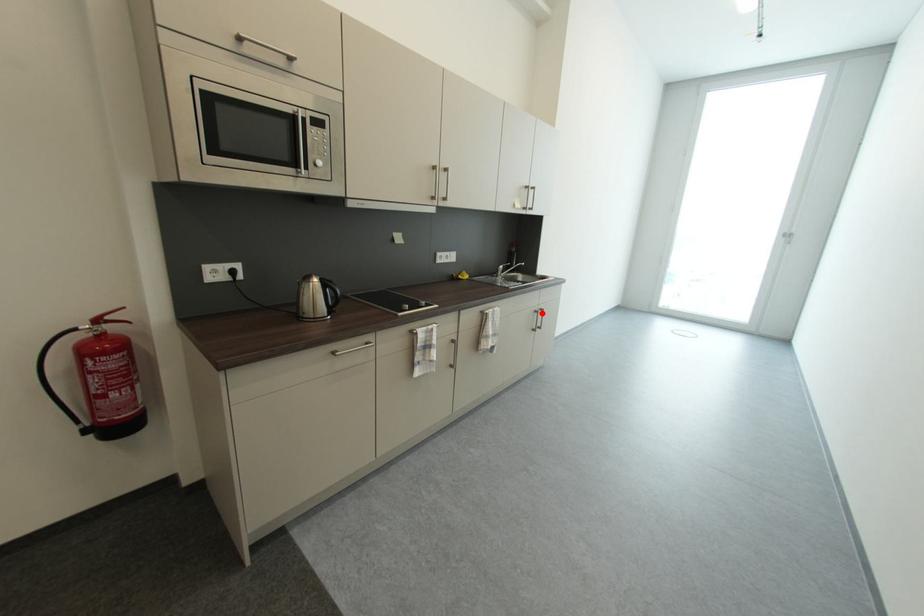
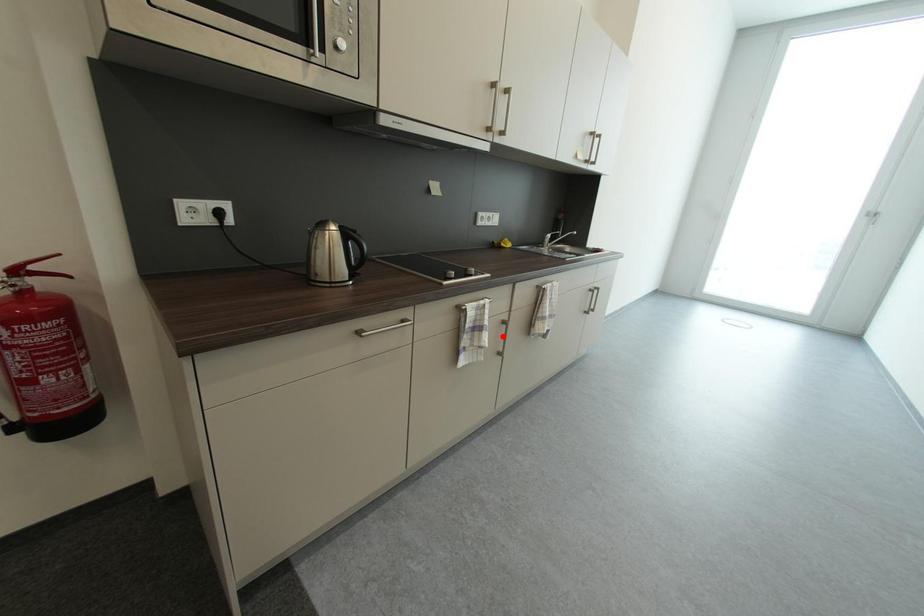
I am providing you with two images of the same scene from different viewpoints. A red point is marked on the first image and another point is marked on the second image. Does the point marked in image1 correspond to the same location as the one in image2?

No